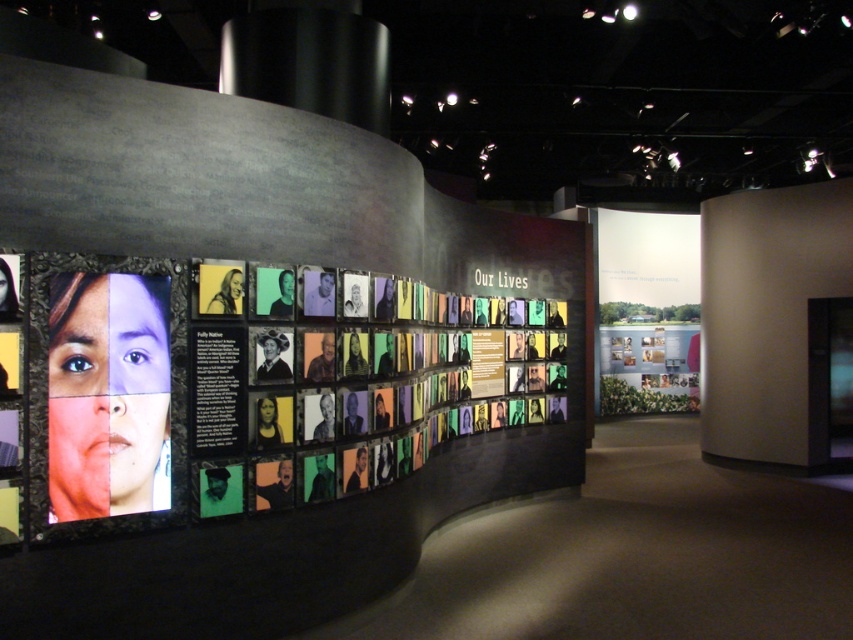
You are standing in the center of the exhibit space and want to locate the matte plastic poster at left. According to the coordinates provided, in which direction should you look to find it?

The matte plastic poster at left is located at coordinates point (108, 396), which means it is positioned to the left side of the exhibit space. Since you are standing in the center, you should look to your left to find it.

You are a visitor standing in front of the matte paper poster at center. Which direction should you move to reach the matte plastic poster at left?

The matte plastic poster at left is to the left of the matte paper poster at center, so you should move to your left to reach it.

You are an art curator planning to install a new exhibition. You have two posters to place on a wall. The matte plastic poster at left and the matte paper poster at center. Which poster should you choose if you want the taller one to be placed in the center of the wall?

The matte paper poster at center is taller than the matte plastic poster at left, so you should choose the matte paper poster at center to be placed in the center of the wall.